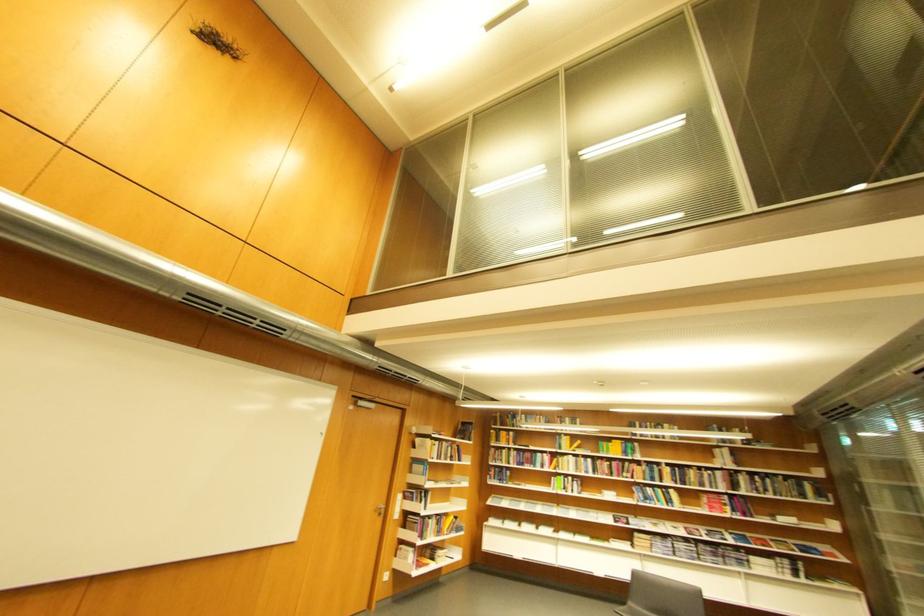
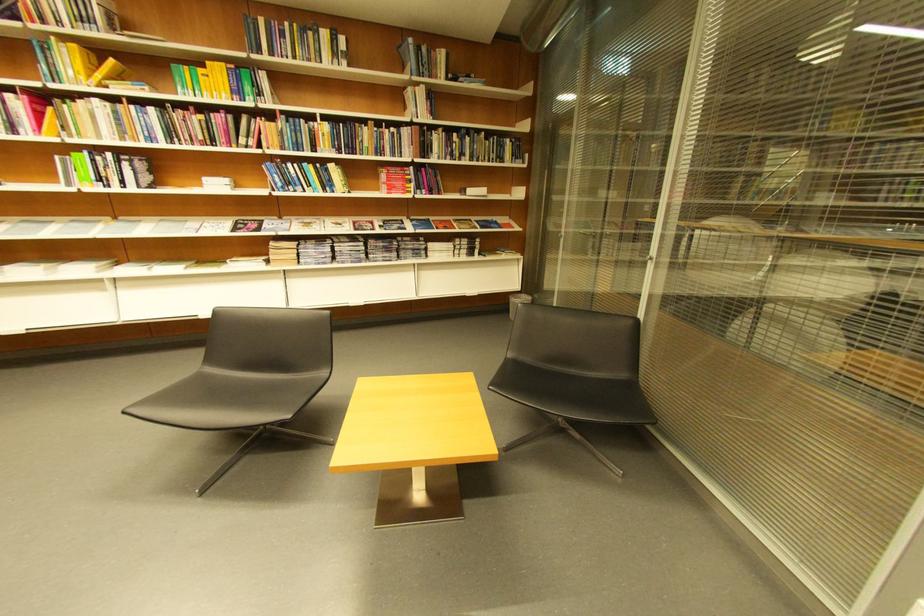
The point at (720, 474) is marked in the first image. Where is the corresponding point in the second image?

(403, 131)